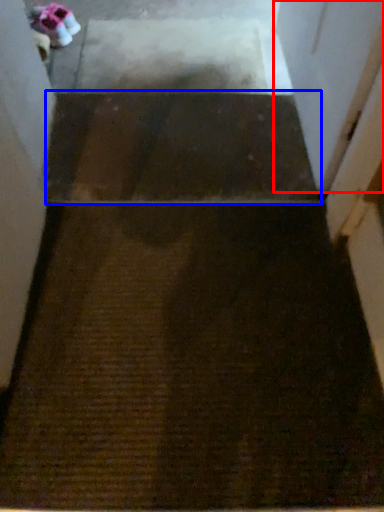
Question: Which of the following is the closest to the observer, screen door (highlighted by a red box) or stairwell (highlighted by a blue box)?

Choices:
 (A) screen door
 (B) stairwell

Answer: (A)